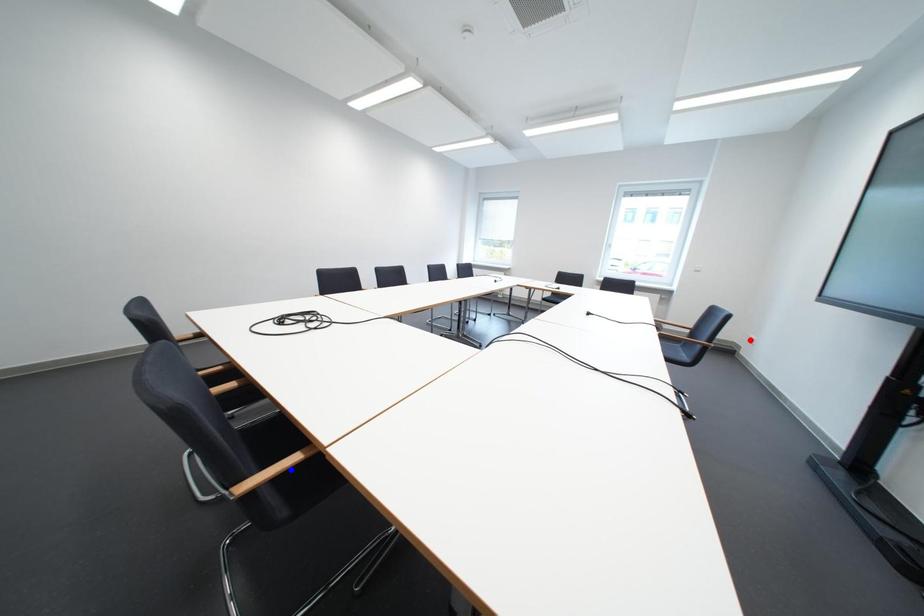
Question: Which of the two points in the image is closer to the camera?

Choices:
 (A) Blue point is closer.
 (B) Red point is closer.

Answer: (A)